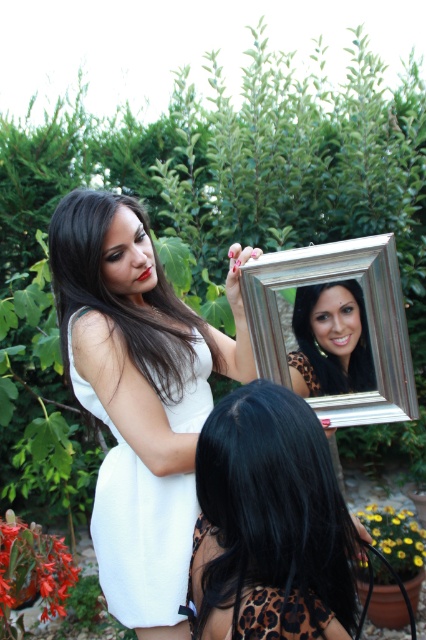
Question: Is white satin dress at center positioned behind white cotton dress at center?

Choices:
 (A) yes
 (B) no

Answer: (B)

Question: Estimate the real-world distances between objects in this image. Which object is closer to the white cotton dress at center?

Choices:
 (A) silver metallic picture frame at upper center
 (B) matte black hair at upper center

Answer: (A)

Question: Does black leopard print dress at lower center appear on the right side of matte black hair at upper center?

Choices:
 (A) no
 (B) yes

Answer: (A)

Question: Which point is farther to the camera?

Choices:
 (A) white cotton dress at center
 (B) matte black hair at upper center
 (C) black leopard print dress at lower center
 (D) silver metallic picture frame at upper center

Answer: (B)

Question: Does black leopard print dress at lower center lie in front of matte black hair at upper center?

Choices:
 (A) no
 (B) yes

Answer: (B)

Question: Based on their relative distances, which object is nearer to the white cotton dress at center?

Choices:
 (A) black leopard print dress at lower center
 (B) matte black hair at upper center

Answer: (A)